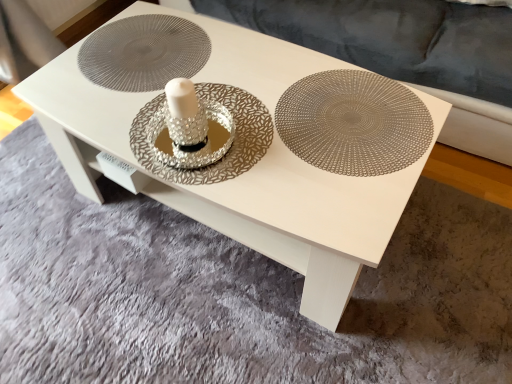
Locate an element on the screen. empty space that is ontop of metallic silver plate at center (from a real-world perspective) is located at coordinates (347, 117).